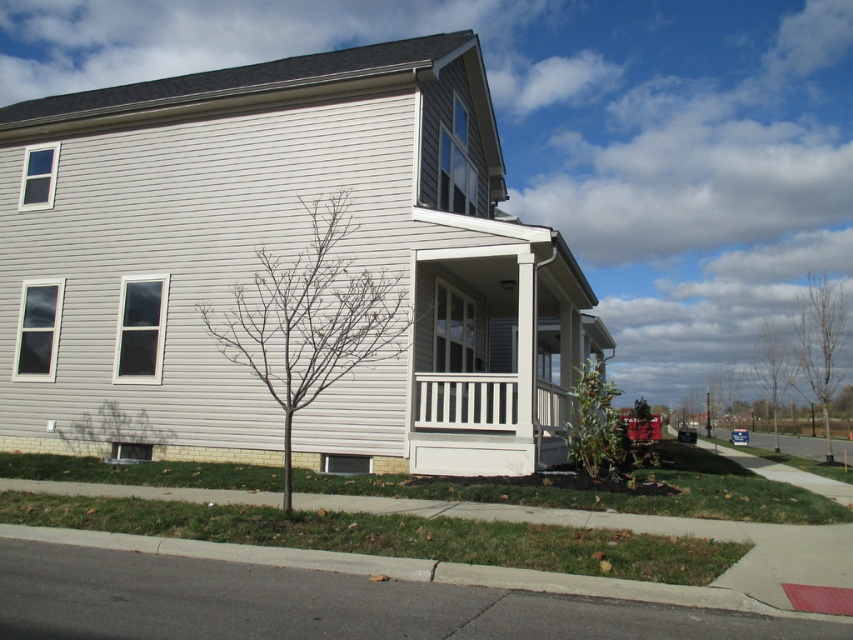
Is point (347, 218) in front of point (831, 330)?

Yes.

Can you confirm if bare branches at lower center is positioned above bare wood tree at right?

Correct, bare branches at lower center is located above bare wood tree at right.

Identify the location of bare branches at lower center. The width and height of the screenshot is (853, 640). (310, 316).

Locate an element on the screen. The width and height of the screenshot is (853, 640). bare branches at lower center is located at coordinates (310, 316).

From the picture: Is bare wood tree at right closer to the viewer compared to green leafy plant at lower right?

No.

Image resolution: width=853 pixels, height=640 pixels. Describe the element at coordinates (819, 346) in the screenshot. I see `bare wood tree at right` at that location.

Is point (799, 304) positioned after point (606, 436)?

That is True.

At what (x,y) coordinates should I click in order to perform the action: click on bare wood tree at right. Please return your answer as a coordinate pair (x, y). The width and height of the screenshot is (853, 640). Looking at the image, I should click on click(819, 346).

Who is shorter, green leafy plant at lower right or bare branches at right?

Standing shorter between the two is green leafy plant at lower right.

Which of these two, green leafy plant at lower right or bare branches at right, stands taller?

bare branches at right is taller.

Which is in front, point (579, 369) or point (775, 369)?

Point (579, 369) is more forward.

This screenshot has width=853, height=640. I want to click on green leafy plant at lower right, so click(596, 424).